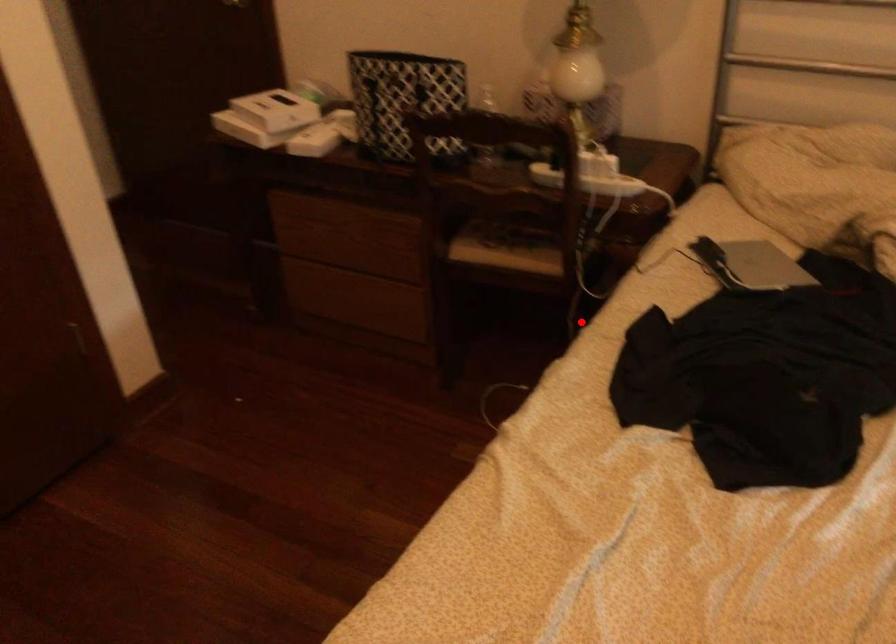
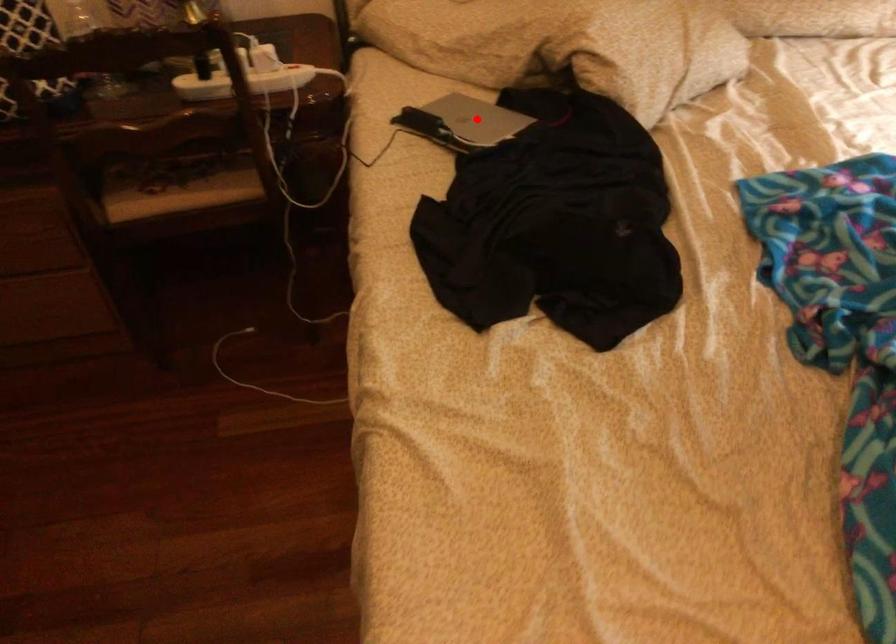
I am providing you with two images of the same scene from different viewpoints. A red point is marked on the first image and another point is marked on the second image. Are the points marked in image1 and image2 representing the same 3D position?

No